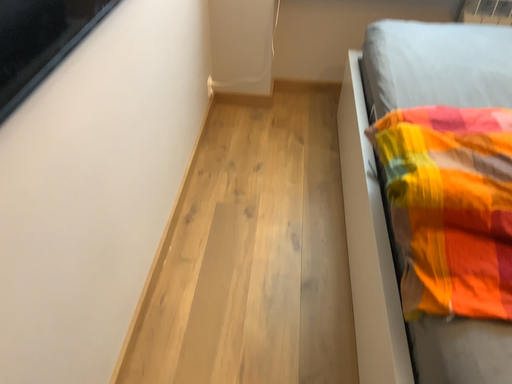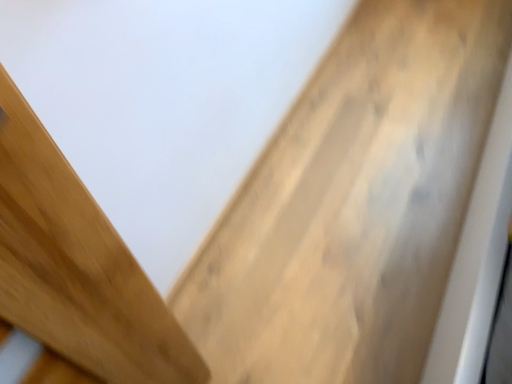
Question: Which way did the camera rotate in the video?

Choices:
 (A) rotated upward
 (B) rotated downward

Answer: (B)